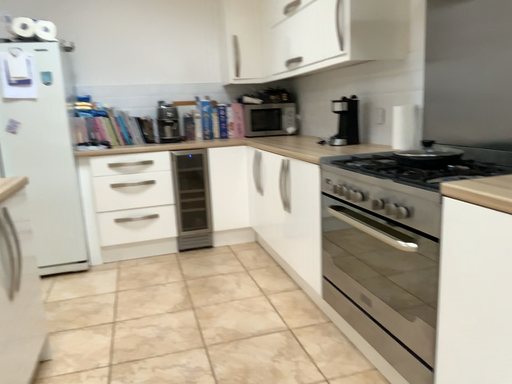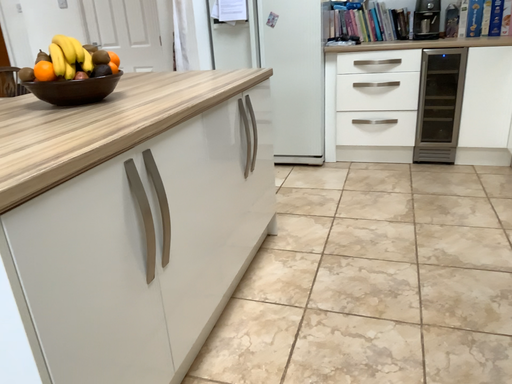
Question: Which way did the camera rotate in the video?

Choices:
 (A) rotated downward
 (B) rotated upward

Answer: (A)